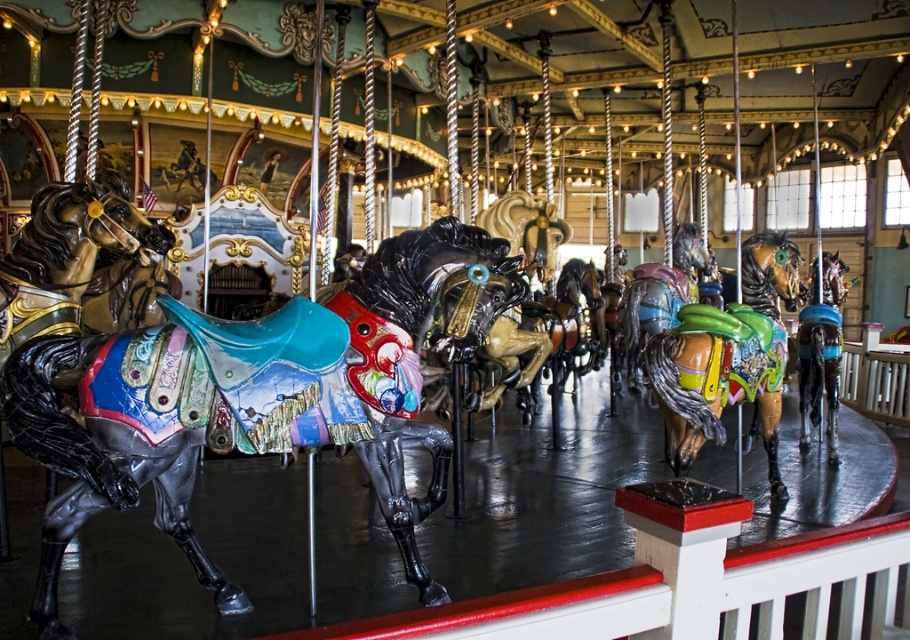
Does point (420, 513) lie in front of point (837, 348)?

Yes, it is.

Is shiny black horse at center bigger than shiny brown horse at right?

No, shiny black horse at center is not bigger than shiny brown horse at right.

Is point (86, 412) farther from camera compared to point (805, 342)?

No, it is not.

Where is `shiny black horse at center`? shiny black horse at center is located at coordinates point(255,397).

Is shiny black horse at center above shiny brown horse at center?

No, shiny black horse at center is not above shiny brown horse at center.

Can you confirm if shiny black horse at center is thinner than shiny brown horse at center?

Incorrect, shiny black horse at center's width is not less than shiny brown horse at center's.

Looking at this image, who is more distant from viewer, (365, 266) or (655, 392)?

The point (655, 392) is behind.

Find the location of `shiny black horse at center`. shiny black horse at center is located at coordinates (255, 397).

Looking at this image, does shiny brown horse at center have a greater height compared to shiny brown horse at right?

In fact, shiny brown horse at center may be shorter than shiny brown horse at right.

Which is above, shiny brown horse at center or shiny brown horse at right?

shiny brown horse at right is higher up.

Which is in front, point (753, 248) or point (823, 291)?

Point (753, 248) is in front.

This screenshot has width=910, height=640. Identify the location of shiny brown horse at center. (728, 356).